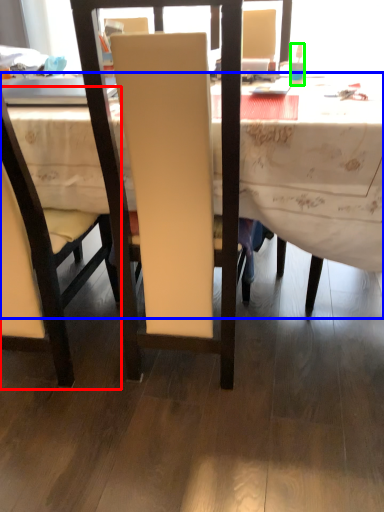
Question: Which object is positioned closest to chair (highlighted by a red box)? Select from desk (highlighted by a blue box) and bottle (highlighted by a green box).

Choices:
 (A) desk
 (B) bottle

Answer: (A)